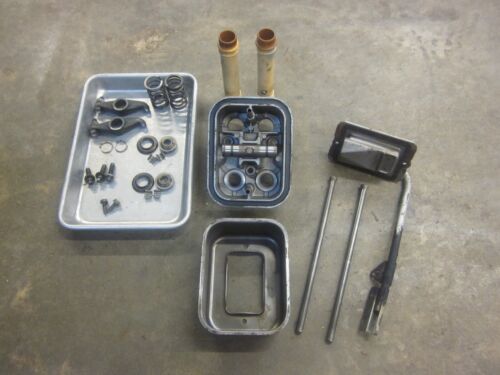
Where is `large metal tray`? The height and width of the screenshot is (375, 500). large metal tray is located at coordinates (90, 210).